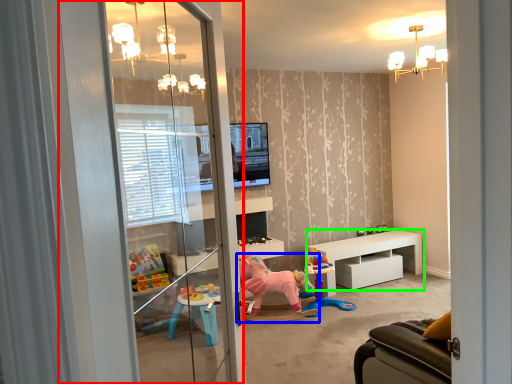
Question: Which object is positioned closest to screen door (highlighted by a red box)? Select from toy (highlighted by a blue box) and table (highlighted by a green box).

Choices:
 (A) toy
 (B) table

Answer: (A)